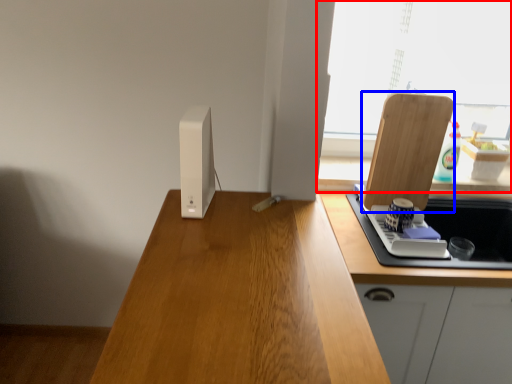
Question: Among these objects, which one is farthest to the camera, window (highlighted by a red box) or cutting board (highlighted by a blue box)?

Choices:
 (A) window
 (B) cutting board

Answer: (A)